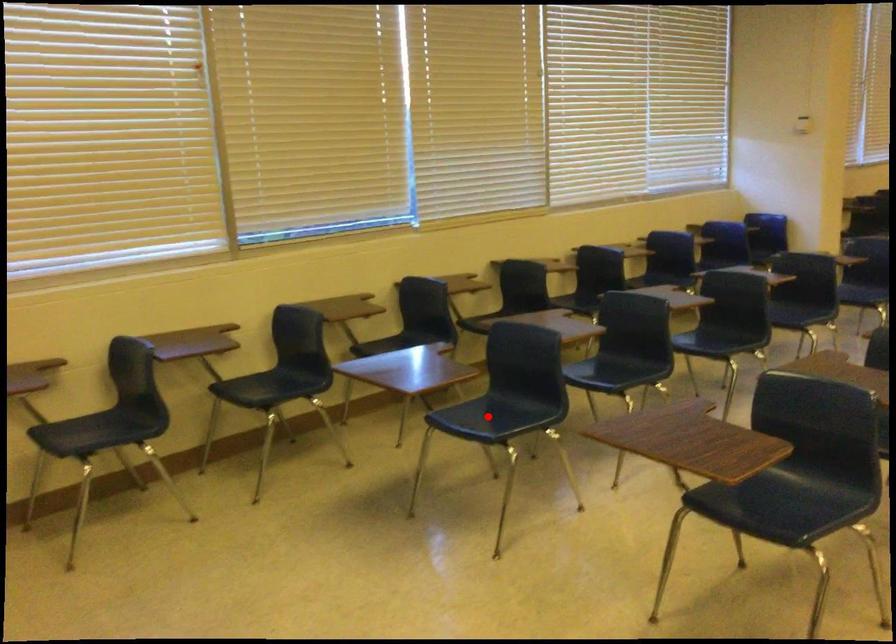
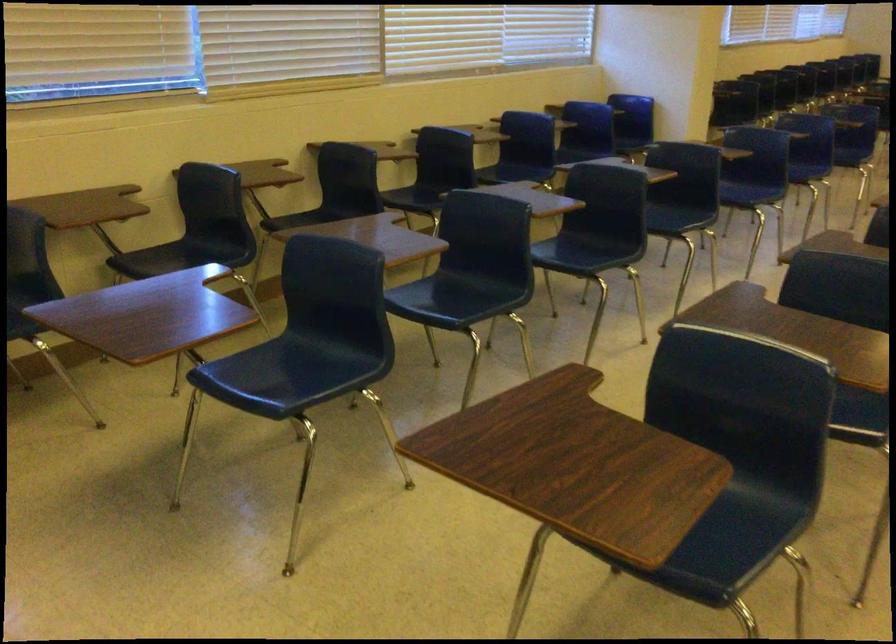
Question: I am providing you with two images of the same scene from different viewpoints. A red point is shown in image1. For the corresponding object point in image2, is it positioned nearer or farther from the camera?

Choices:
 (A) Nearer
 (B) Farther

Answer: (A)